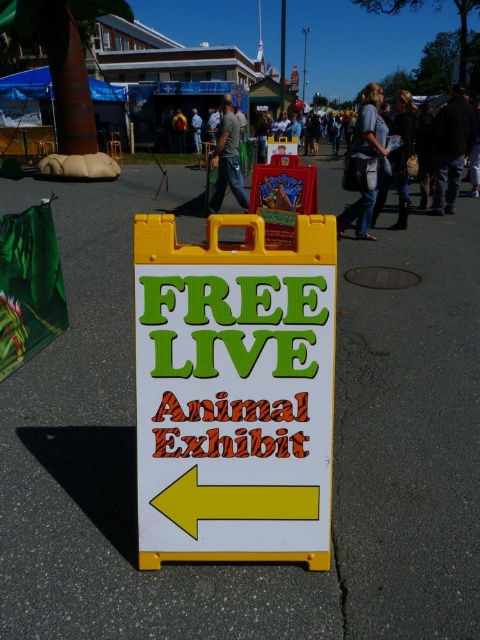
You are standing at the point labeled as point (451, 148) in the image. What is the color of the clothing item you are currently standing on?

The point (451, 148) is on dark blue jeans at center, so the color of the clothing item you are currently standing on is dark blue.

You are a visitor at the fair and want to read the white plastic sign at center. However, your friend wearing dark blue jeans at center is blocking your view. Which direction should you move to see the sign clearly?

Since the white plastic sign at center is to the left of dark blue jeans at center, you should move to the right side of your friend to see the sign clearly.

You are a photographer trying to capture a person wearing dark blue jeans at center and matte green shirt at center. To ensure the entire outfit is visible, should you focus on the upper or lower part of the person?

You should focus on the upper part of the person because the dark blue jeans at center is positioned under the matte green shirt at center, meaning the shirt is above the jeans.